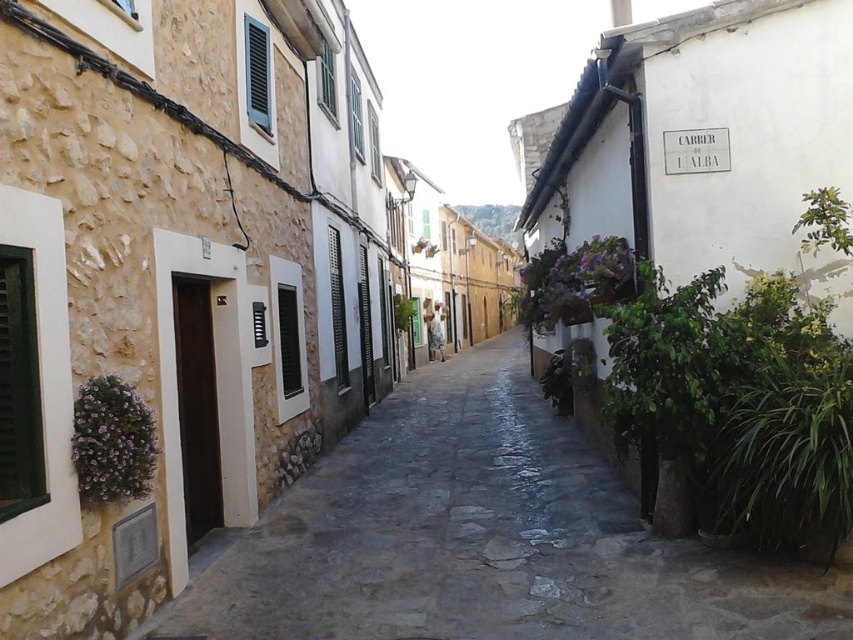
Question: Which object appears farthest from the camera in this image?

Choices:
 (A) green matte shutter at center
 (B) blue painted wood shutter at upper center
 (C) smooth stone alley at center
 (D) green leafy plant at center

Answer: (D)

Question: Does purple matte plant at lower left have a greater width compared to green matte shutter at center?

Choices:
 (A) yes
 (B) no

Answer: (A)

Question: Among these objects, which one is nearest to the camera?

Choices:
 (A) smooth stone alley at center
 (B) green textured shutter at left
 (C) green matte shutter at center

Answer: (B)

Question: Considering the real-world distances, which object is farthest from the purple matte plant at lower left?

Choices:
 (A) green leafy plant at right
 (B) smooth stone alley at center
 (C) green textured shutter at left
 (D) green matte shutter at center

Answer: (D)

Question: From the image, what is the correct spatial relationship of smooth stone alley at center in relation to purple matte plant at lower left?

Choices:
 (A) below
 (B) above

Answer: (A)

Question: In this image, where is green textured shutter at left located relative to green leafy plant at center?

Choices:
 (A) right
 (B) left

Answer: (B)